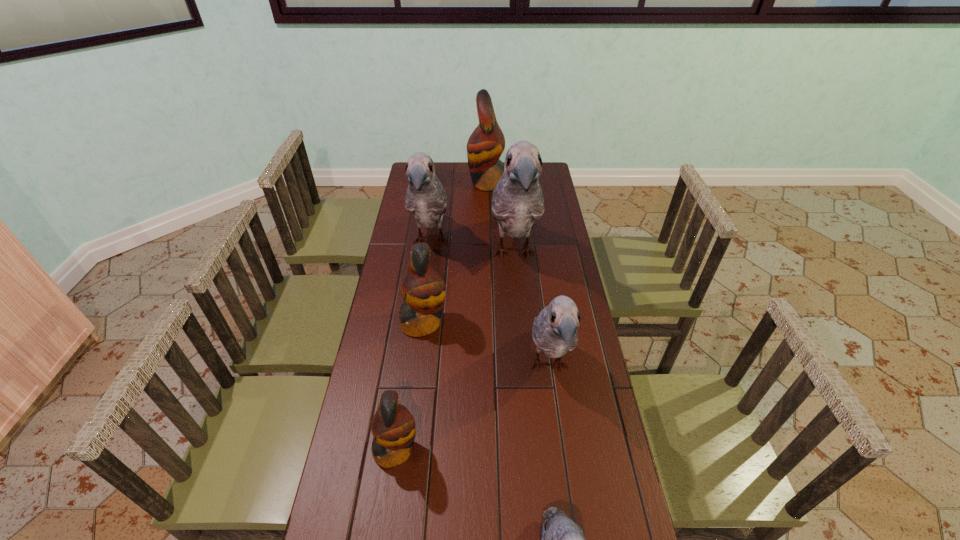
This screenshot has width=960, height=540. In order to click on the biggest gray parrot in this screenshot , I will do `click(517, 201)`.

Find the location of `the tallest object`. the tallest object is located at coordinates (517, 201).

Find the location of a particular element. Image resolution: width=960 pixels, height=540 pixels. the biggest red parrot is located at coordinates (486, 144).

At what (x,y) coordinates should I click in order to perform the action: click on the farthest object. Please return your answer as a coordinate pair (x, y). The image size is (960, 540). Looking at the image, I should click on (486, 144).

The height and width of the screenshot is (540, 960). Find the location of `the leftmost gray parrot`. the leftmost gray parrot is located at coordinates (426, 199).

I want to click on the second nearest red parrot, so click(423, 289).

Where is `the second nearest gray parrot`? the second nearest gray parrot is located at coordinates click(554, 332).

The image size is (960, 540). I want to click on the nearest red parrot, so click(393, 426).

I want to click on the smallest red parrot, so click(x=393, y=426).

Where is `vacant space located on the front-facing side of the tallest object`? vacant space located on the front-facing side of the tallest object is located at coordinates (518, 307).